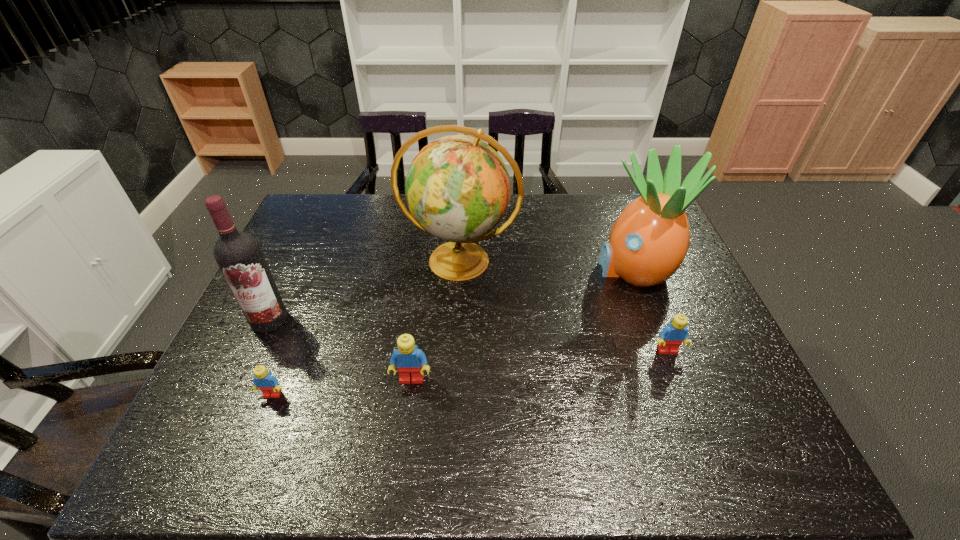
Please point a spot to place another Lego for symmetrical spacing. Please provide its 2D coordinates. Your answer should be formatted as a tuple, i.e. [(x, y)], where the tuple contains the x and y coordinates of a point satisfying the conditions above.

[(543, 364)]